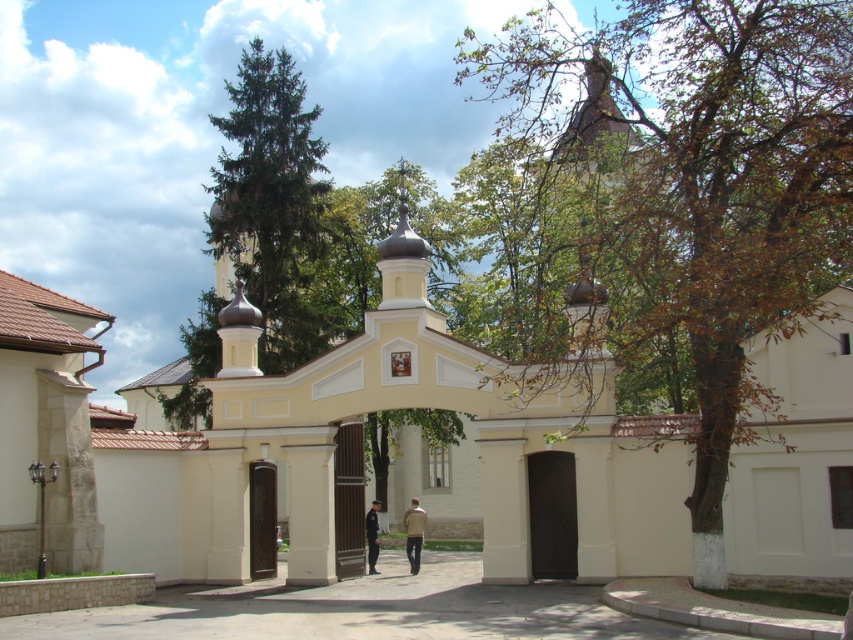
Question: Which point is farther to the camera?

Choices:
 (A) (364, 524)
 (B) (421, 541)

Answer: (A)

Question: Does beige fabric jacket at center appear over uniformed officer at center?

Choices:
 (A) no
 (B) yes

Answer: (B)

Question: Which point is farther to the camera?

Choices:
 (A) (x=408, y=560)
 (B) (x=372, y=520)

Answer: (A)

Question: Is beige fabric jacket at center to the left of uniformed officer at center from the viewer's perspective?

Choices:
 (A) no
 (B) yes

Answer: (A)

Question: Does beige fabric jacket at center appear under uniformed officer at center?

Choices:
 (A) yes
 (B) no

Answer: (B)

Question: Which point is farther to the camera?

Choices:
 (A) (421, 524)
 (B) (375, 556)

Answer: (A)